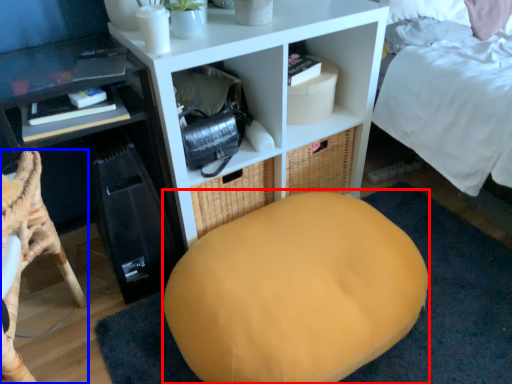
Question: Which object appears farthest to the camera in this image, bean bag chair (highlighted by a red box) or furniture (highlighted by a blue box)?

Choices:
 (A) bean bag chair
 (B) furniture

Answer: (A)